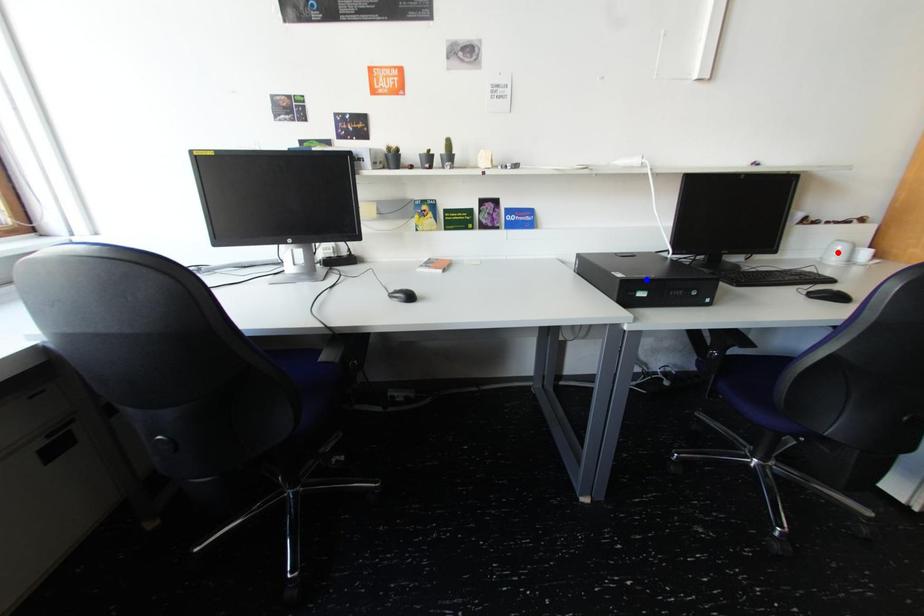
Question: Two points are marked on the image. Which point is closer to the camera?

Choices:
 (A) Blue point is closer.
 (B) Red point is closer.

Answer: (A)